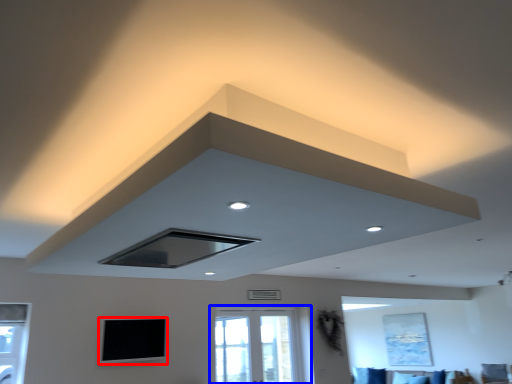
Question: Which object appears closest to the camera in this image, window screen (highlighted by a red box) or window (highlighted by a blue box)?

Choices:
 (A) window screen
 (B) window

Answer: (A)